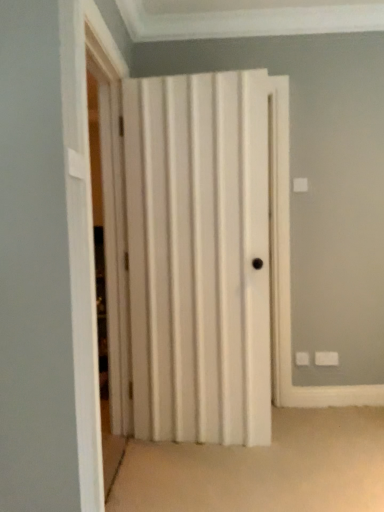
The height and width of the screenshot is (512, 384). In order to click on free spot to the right of white wood folding door at center in this screenshot , I will do `click(219, 471)`.